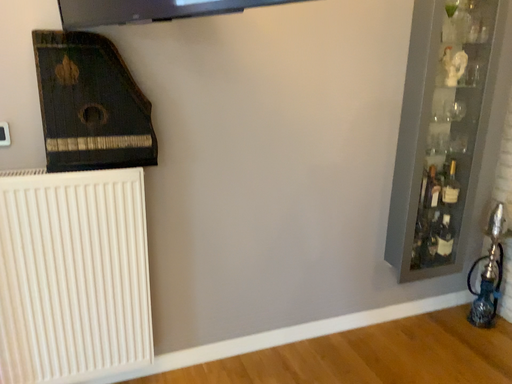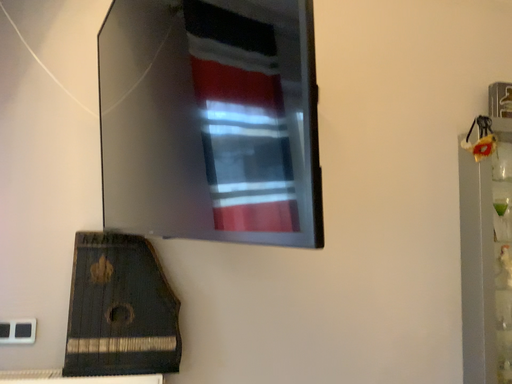
Question: How did the camera likely rotate when shooting the video?

Choices:
 (A) rotated downward
 (B) rotated upward

Answer: (B)